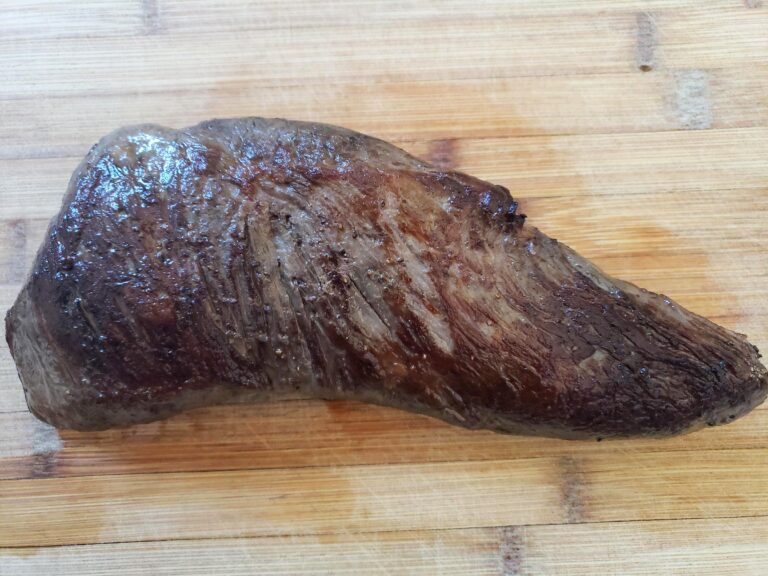
Find the location of a particular element. juice stains is located at coordinates (502, 159).